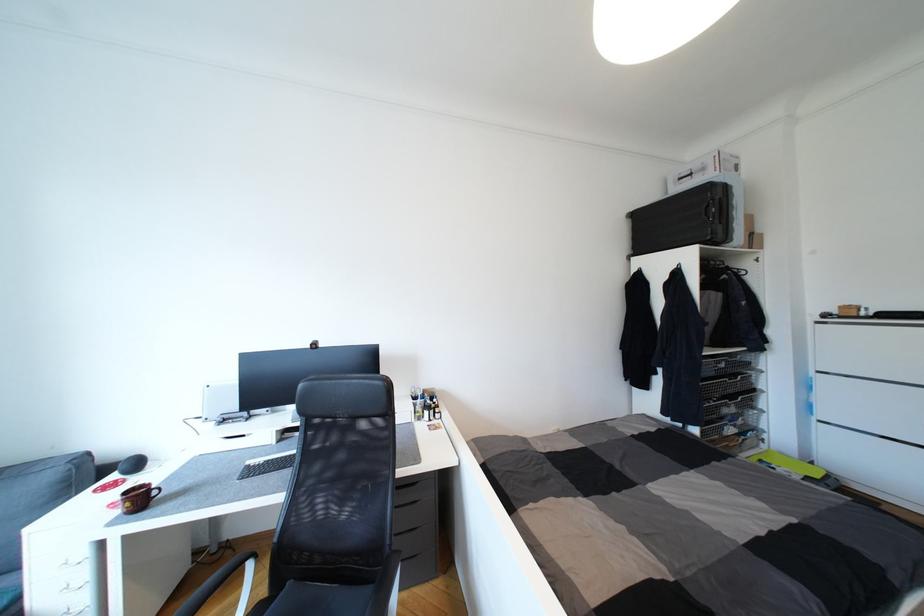
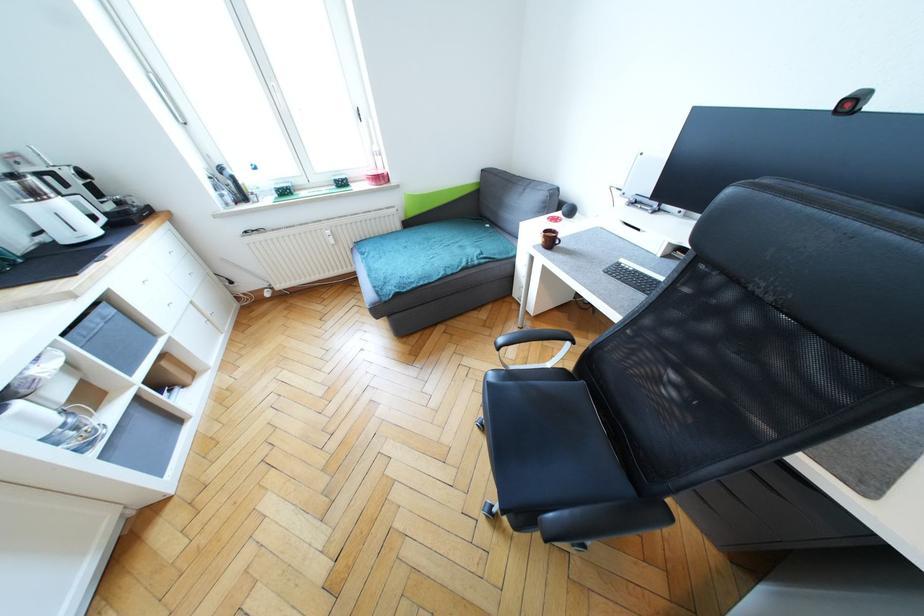
Find the pixel in the second image that matches [152,492] in the first image.

(558, 238)